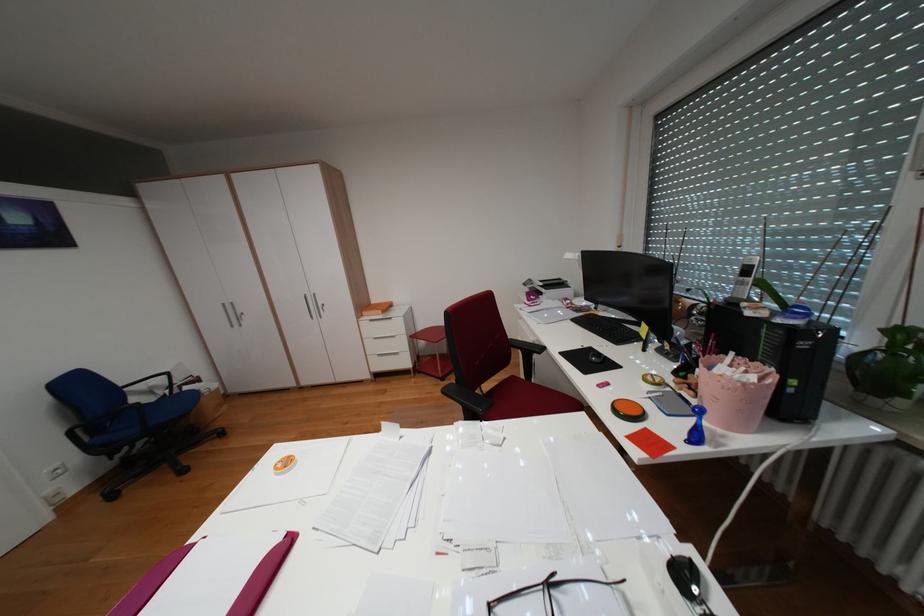
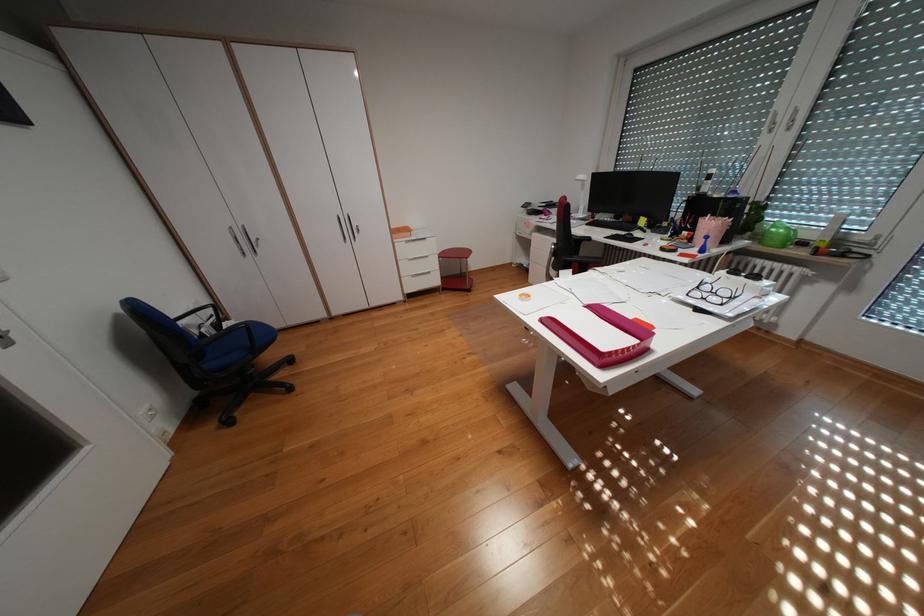
Question: Which direction would the cameraman need to move to produce the second image? Reply with the corresponding letter.

Choices:
 (A) Left
 (B) Right
 (C) Forward
 (D) Backward

Answer: (A)